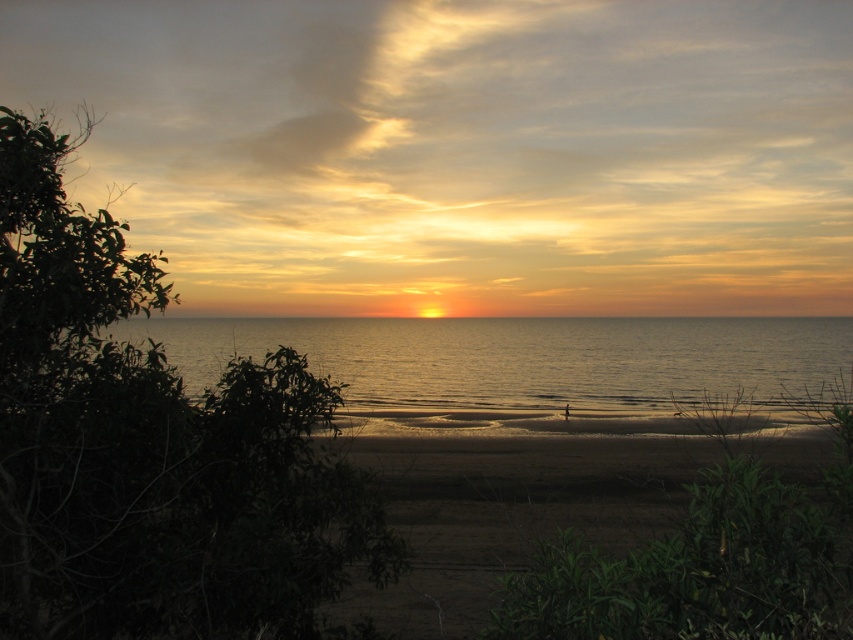
Question: Which of the following is the closest to the observer?

Choices:
 (A) (404, 320)
 (B) (828, 554)

Answer: (B)

Question: Is golden reflective water at center to the right of brown sandy beach at center from the viewer's perspective?

Choices:
 (A) yes
 (B) no

Answer: (B)

Question: In this image, where is golden reflective water at center located relative to brown sandy beach at center?

Choices:
 (A) left
 (B) right

Answer: (A)

Question: Is golden reflective water at center below brown sandy beach at center?

Choices:
 (A) yes
 (B) no

Answer: (B)